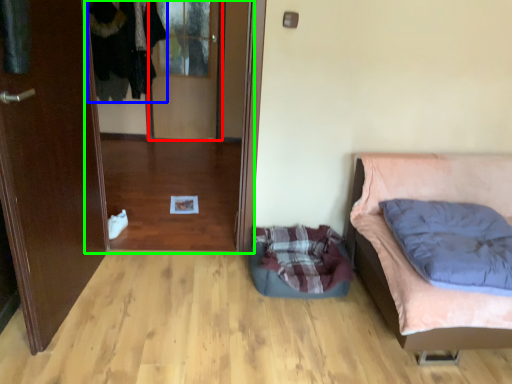
Question: Estimate the real-world distances between objects in this image. Which object is closer to glass door (highlighted by a red box), clothing (highlighted by a blue box) or glass door (highlighted by a green box)?

Choices:
 (A) clothing
 (B) glass door

Answer: (A)